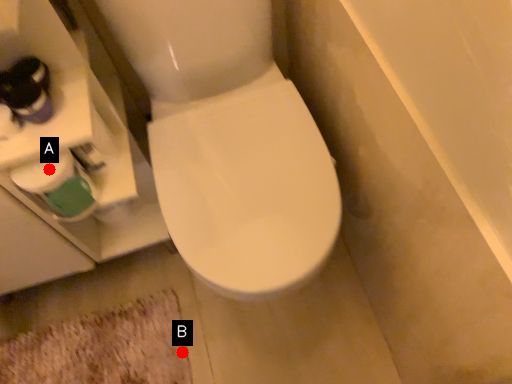
Question: Two points are circled on the image, labeled by A and B beside each circle. Among these points, which one is nearest to the camera?

Choices:
 (A) A is closer
 (B) B is closer

Answer: (A)